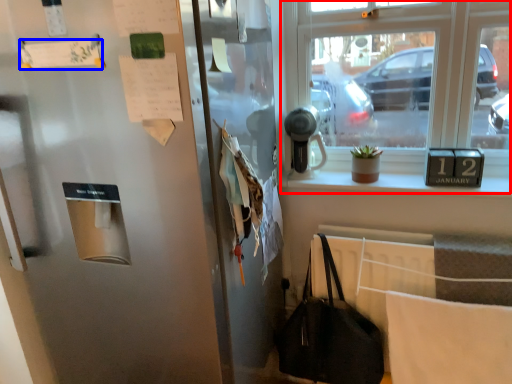
Question: Which object appears farthest to the camera in this image, window (highlighted by a red box) or paper (highlighted by a blue box)?

Choices:
 (A) window
 (B) paper

Answer: (A)